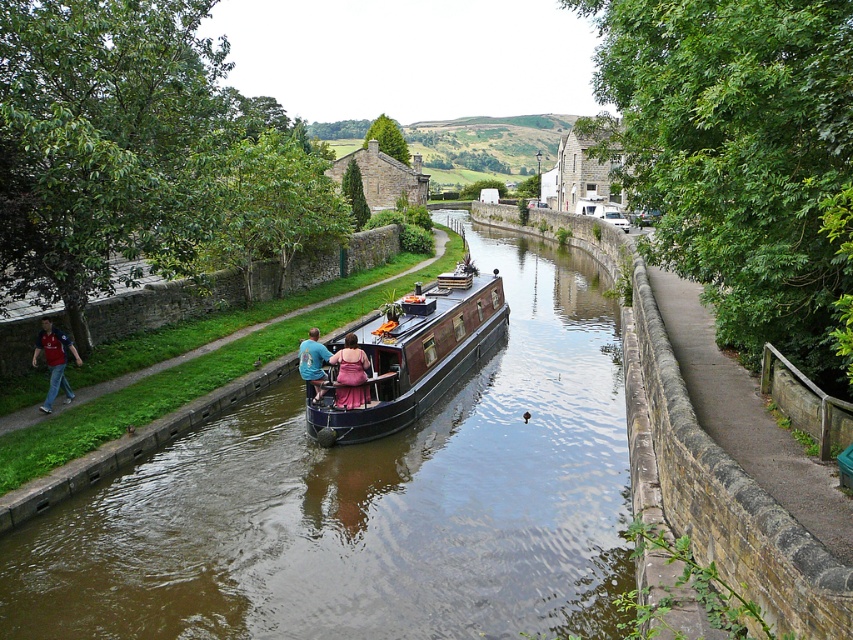
You are standing on the bank of the canal and see two points marked on the narrowboat. Which of the two points, point (328, 403) or point (350, 369), is closer to you?

Point (328, 403) is closer to you because it is further to the viewer than point (350, 369).

You are standing at the center of the canal and want to reach the stone paved path at right. Which direction should you move to get there?

The stone paved path at right is located at coordinates point [732,502], so you should move towards the right side of the canal to reach it.